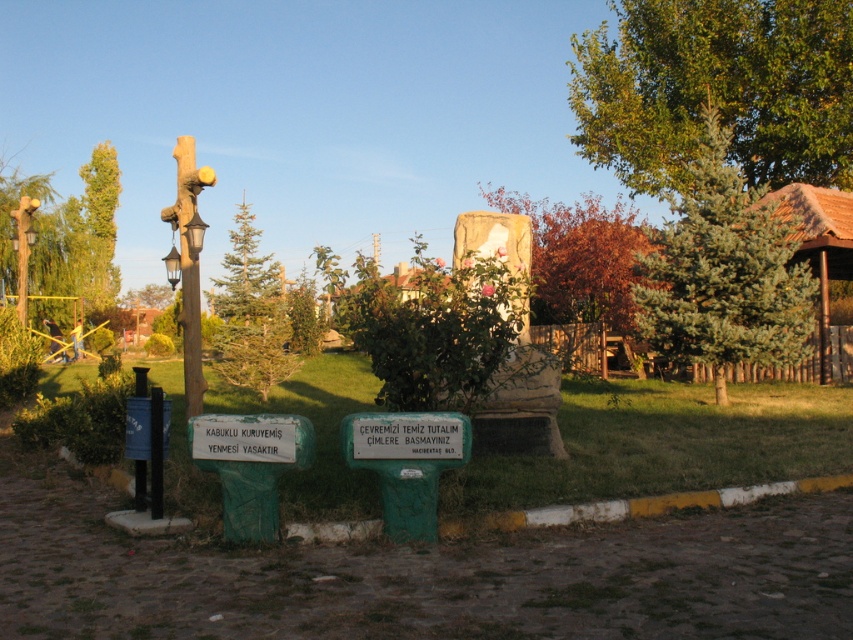
Does green fir tree at upper right have a greater width compared to green leafy tree at upper left?

No, green fir tree at upper right is not wider than green leafy tree at upper left.

Measure the distance between green fir tree at upper right and green leafy tree at upper left.

82.11 feet

Is point (747, 218) farther from viewer compared to point (86, 300)?

No, (747, 218) is in front of (86, 300).

You are a GUI agent. You are given a task and a screenshot of the screen. Output one action in this format:
    pyautogui.click(x=<x>, y=<y>)
    Task: Click on the green fir tree at upper right
    
    Given the screenshot: What is the action you would take?
    pyautogui.click(x=724, y=273)

From the picture: Is white plastic sign at center to the right of brushed metal pole at left from the viewer's perspective?

Indeed, white plastic sign at center is positioned on the right side of brushed metal pole at left.

Image resolution: width=853 pixels, height=640 pixels. In order to click on white plastic sign at center in this screenshot , I will do `click(407, 436)`.

Can you confirm if green textured tree at center is taller than white plastic sign at center?

Yes.

Is green textured tree at center shorter than white plastic sign at center?

In fact, green textured tree at center may be taller than white plastic sign at center.

Is point (218, 300) positioned before point (386, 448)?

No, it is behind (386, 448).

The height and width of the screenshot is (640, 853). Identify the location of green textured tree at center. (251, 314).